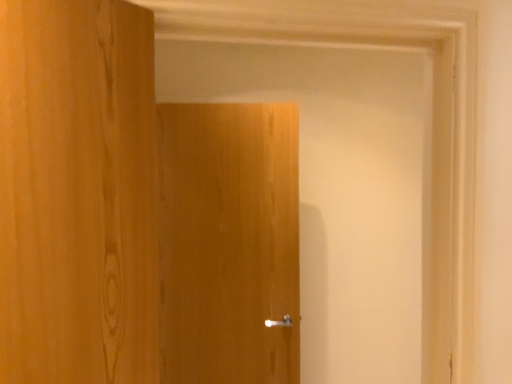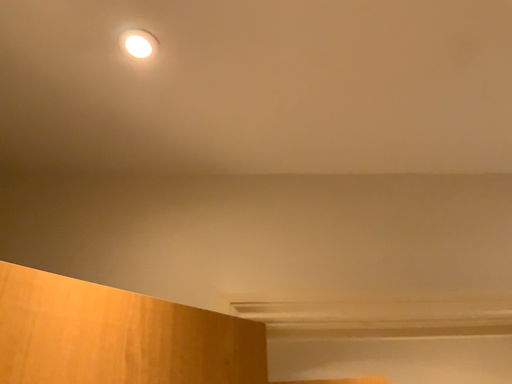
Question: Which way did the camera rotate in the video?

Choices:
 (A) rotated upward
 (B) rotated downward

Answer: (A)